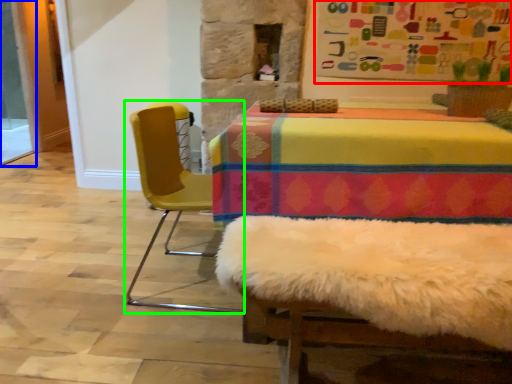
Question: Which is nearer to the bulletin board (highlighted by a red box)? screen door (highlighted by a blue box) or chair (highlighted by a green box).

Choices:
 (A) screen door
 (B) chair

Answer: (B)